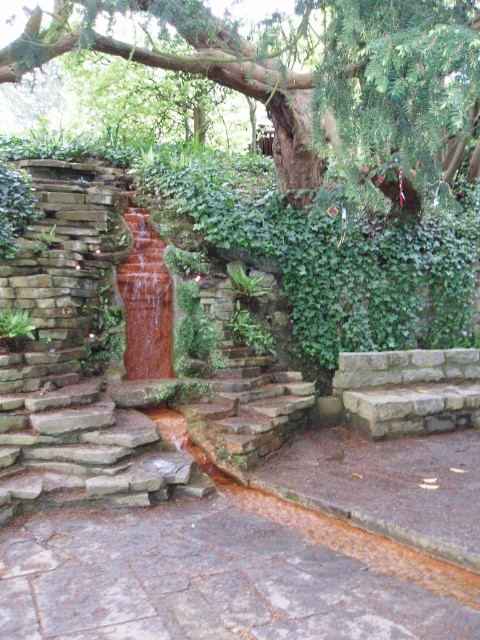
Between brown stone stairs at center and translucent amber water at center, which one appears on the left side from the viewer's perspective?

Positioned to the left is translucent amber water at center.

Can you confirm if brown stone stairs at center is shorter than translucent amber water at center?

Yes, brown stone stairs at center is shorter than translucent amber water at center.

Which is behind, point (218, 280) or point (132, 358)?

Point (218, 280)

Identify the location of brown stone stairs at center. (244, 396).

Is point (226, 42) farther from viewer compared to point (145, 310)?

Yes, point (226, 42) is farther from viewer.

Which is below, green leafy tree at upper center or translucent amber water at center?

Positioned lower is translucent amber water at center.

You are a GUI agent. You are given a task and a screenshot of the screen. Output one action in this format:
    pyautogui.click(x=<x>, y=<y>)
    Task: Click on the green leafy tree at upper center
    The width and height of the screenshot is (480, 640).
    Given the screenshot: What is the action you would take?
    pyautogui.click(x=310, y=76)

Between brown stone path at center and brown stone stairs at center, which one appears on the right side from the viewer's perspective?

brown stone stairs at center is more to the right.

Does brown stone path at center appear on the right side of brown stone stairs at center?

Incorrect, brown stone path at center is not on the right side of brown stone stairs at center.

This screenshot has height=640, width=480. In order to click on brown stone path at center in this screenshot , I will do `click(212, 580)`.